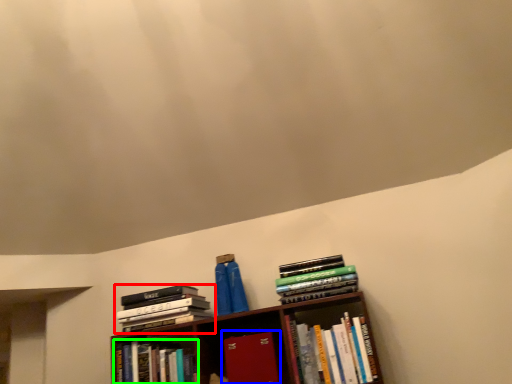
Question: Which object is the closest to the book (highlighted by a red box)? Choose among these: book (highlighted by a blue box) or book (highlighted by a green box).

Choices:
 (A) book
 (B) book

Answer: (B)